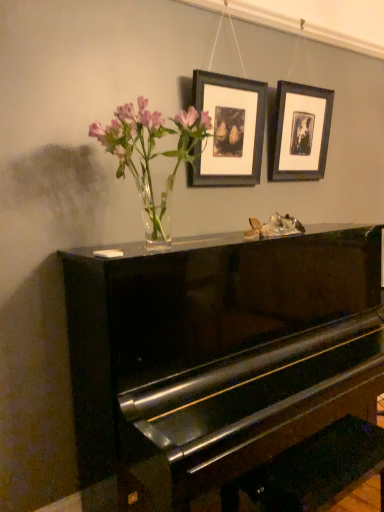
Question: In which direction should I rotate to look at matte black picture frame at upper center, the 2th picture frame positioned from the back?

Choices:
 (A) left
 (B) right

Answer: (B)

Question: From a real-world perspective, is matte black picture frame at upper center, the 2th picture frame positioned from the back, beneath matte black picture frame at upper right, the 2th picture frame positioned from the front?

Choices:
 (A) yes
 (B) no

Answer: (A)

Question: Could you tell me if matte black picture frame at upper center, the 2th picture frame positioned from the back, is turned towards matte black picture frame at upper right, the 1th picture frame when ordered from right to left?

Choices:
 (A) yes
 (B) no

Answer: (B)

Question: Can you confirm if matte black picture frame at upper center, marked as the second picture frame in a right-to-left arrangement, is positioned to the right of matte black picture frame at upper right, the 2th picture frame positioned from the front?

Choices:
 (A) no
 (B) yes

Answer: (A)

Question: Does matte black picture frame at upper center, the 2th picture frame positioned from the back, come in front of matte black picture frame at upper right, the 1th picture frame when ordered from right to left?

Choices:
 (A) yes
 (B) no

Answer: (A)

Question: From the image's perspective, is matte black picture frame at upper center, marked as the second picture frame in a right-to-left arrangement, below matte black picture frame at upper right, the 2th picture frame positioned from the front?

Choices:
 (A) no
 (B) yes

Answer: (B)

Question: Is matte black picture frame at upper center, the 2th picture frame positioned from the back, bigger than matte black picture frame at upper right, marked as the second picture frame in a left-to-right arrangement?

Choices:
 (A) yes
 (B) no

Answer: (B)

Question: Does matte black picture frame at upper right, the 2th picture frame positioned from the front, have a greater width compared to matte black picture frame at upper center, acting as the first picture frame starting from the left?

Choices:
 (A) yes
 (B) no

Answer: (A)

Question: Can you confirm if matte black picture frame at upper right, acting as the 1th picture frame starting from the back, is smaller than matte black picture frame at upper center, acting as the first picture frame starting from the left?

Choices:
 (A) yes
 (B) no

Answer: (B)

Question: Does matte black picture frame at upper right, the 2th picture frame positioned from the front, lie in front of matte black picture frame at upper center, acting as the first picture frame starting from the left?

Choices:
 (A) no
 (B) yes

Answer: (A)

Question: From a real-world perspective, is matte black picture frame at upper right, the 2th picture frame positioned from the front, on top of matte black picture frame at upper center, marked as the second picture frame in a right-to-left arrangement?

Choices:
 (A) no
 (B) yes

Answer: (B)

Question: Is matte black picture frame at upper right, acting as the 1th picture frame starting from the back, oriented towards matte black picture frame at upper center, the 2th picture frame positioned from the back?

Choices:
 (A) no
 (B) yes

Answer: (A)

Question: From the image's perspective, is matte black picture frame at upper right, acting as the 1th picture frame starting from the back, on matte black picture frame at upper center, the 2th picture frame positioned from the back?

Choices:
 (A) yes
 (B) no

Answer: (A)

Question: Is clear glass vase at upper center closer to camera compared to glossy black piano at center?

Choices:
 (A) yes
 (B) no

Answer: (B)